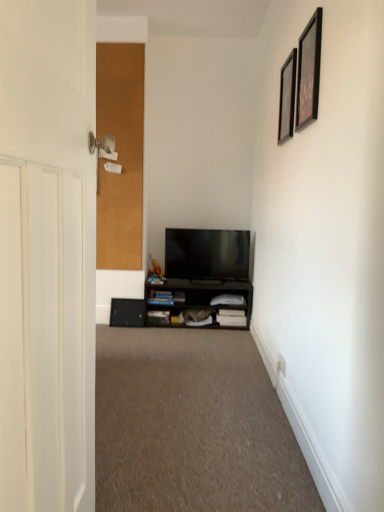
Question: Is black matte cabinet at lower center shorter than black glossy picture frame at upper right, acting as the first picture frame starting from the front?

Choices:
 (A) yes
 (B) no

Answer: (A)

Question: Are black matte cabinet at lower center and black glossy picture frame at upper right, acting as the first picture frame starting from the front, far apart?

Choices:
 (A) yes
 (B) no

Answer: (A)

Question: Is the depth of black matte cabinet at lower center greater than that of black glossy picture frame at upper right, the 2th picture frame when ordered from back to front?

Choices:
 (A) yes
 (B) no

Answer: (A)

Question: Is black matte cabinet at lower center oriented towards black glossy picture frame at upper right, the 2th picture frame when ordered from back to front?

Choices:
 (A) yes
 (B) no

Answer: (B)

Question: Is black matte cabinet at lower center directly adjacent to black glossy picture frame at upper right, acting as the first picture frame starting from the front?

Choices:
 (A) no
 (B) yes

Answer: (A)

Question: Does black matte cabinet at lower center have a greater height compared to black glossy picture frame at upper right, acting as the first picture frame starting from the front?

Choices:
 (A) yes
 (B) no

Answer: (B)

Question: Can you confirm if carpet at center is thinner than flat screen tv at center?

Choices:
 (A) no
 (B) yes

Answer: (A)

Question: From a real-world perspective, is carpet at center located beneath flat screen tv at center?

Choices:
 (A) no
 (B) yes

Answer: (B)

Question: Can you confirm if carpet at center is smaller than flat screen tv at center?

Choices:
 (A) yes
 (B) no

Answer: (B)

Question: Is carpet at center behind flat screen tv at center?

Choices:
 (A) yes
 (B) no

Answer: (B)

Question: Are carpet at center and flat screen tv at center located far from each other?

Choices:
 (A) no
 (B) yes

Answer: (B)

Question: Is carpet at center positioned in front of flat screen tv at center?

Choices:
 (A) no
 (B) yes

Answer: (B)

Question: From a real-world perspective, does carpet at center sit lower than black matte cabinet at lower center?

Choices:
 (A) yes
 (B) no

Answer: (A)